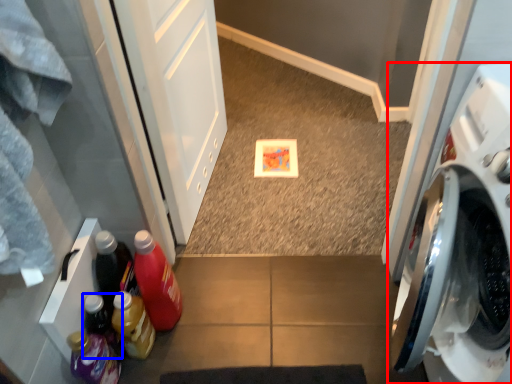
Question: Which point is closer to the camera, washing machine (highlighted by a red box) or bottle (highlighted by a blue box)?

Choices:
 (A) washing machine
 (B) bottle

Answer: (A)